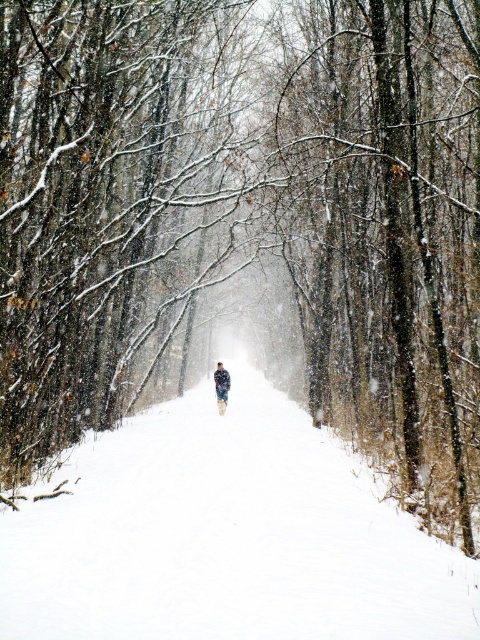
What are the coordinates of `white fluffy snow at center` in the screenshot? It's located at (226, 536).

Does white fluffy snow at center appear over fluffy white snowsuit at center?

No, white fluffy snow at center is not above fluffy white snowsuit at center.

Locate an element on the screen. The image size is (480, 640). white fluffy snow at center is located at coordinates (226, 536).

The width and height of the screenshot is (480, 640). In order to click on white fluffy snow at center in this screenshot , I will do `click(226, 536)`.